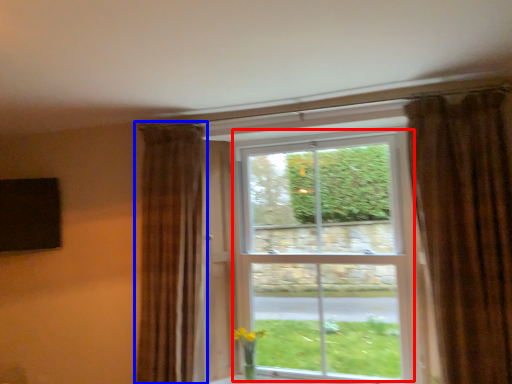
Question: Which point is further to the camera, bay window (highlighted by a red box) or curtain (highlighted by a blue box)?

Choices:
 (A) bay window
 (B) curtain

Answer: (A)